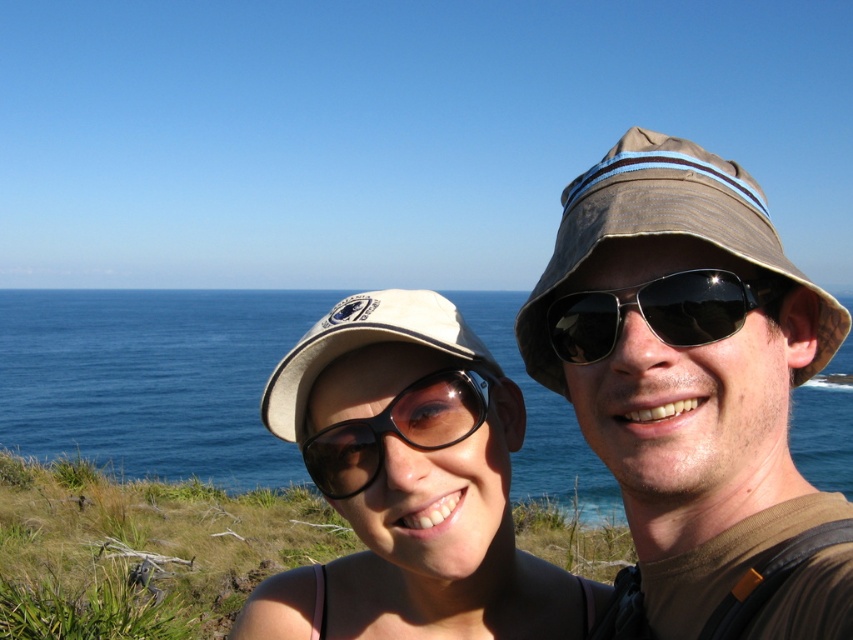
Based on the photo, you are a photographer trying to capture a clear shot of both the matte brown hat at upper right and the white fabric baseball cap at upper center. Since you want both hats to be fully visible in the frame, which hat should you adjust your camera angle to focus on first, considering their height?

The matte brown hat at upper right is taller than the white fabric baseball cap at upper center, so you should focus on the matte brown hat at upper right first to ensure it fits in the frame, then adjust for the smaller one.

You are a photographer trying to capture a photo of both the matte brown hat at upper right and the white fabric baseball cap at upper center. Based on their positions, which hat should you focus on first to ensure both are in the frame?

The matte brown hat at upper right is to the right of the white fabric baseball cap at upper center, so you should focus on the white fabric baseball cap at upper center first to ensure both are in the frame.